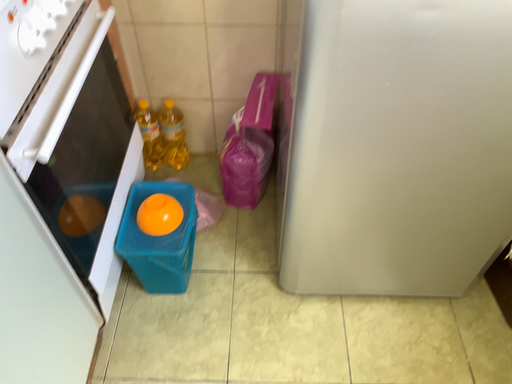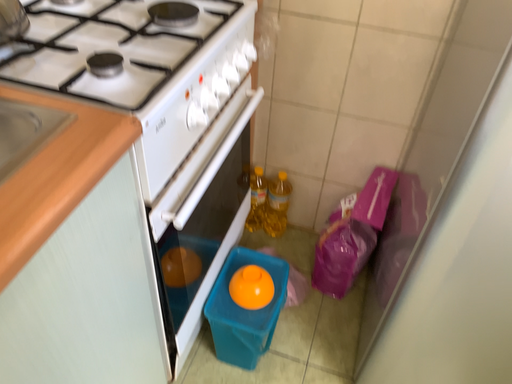
Question: Which way did the camera rotate in the video?

Choices:
 (A) rotated left
 (B) rotated right

Answer: (A)